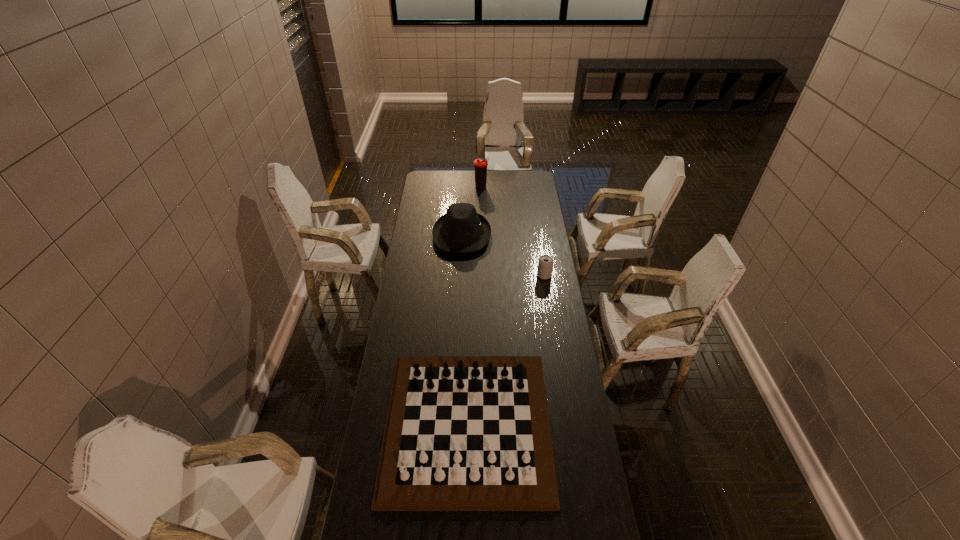
Find the location of a particular element. This screenshot has width=960, height=540. unoccupied position between the third shortest object and the gameboard is located at coordinates (465, 329).

At what (x,y) coordinates should I click in order to perform the action: click on free space between the farthest object and the gameboard. Please return your answer as a coordinate pair (x, y). The image size is (960, 540). Looking at the image, I should click on (474, 306).

The height and width of the screenshot is (540, 960). What are the coordinates of `vacant area between the fedora and the nearest object` in the screenshot? It's located at (465, 329).

I want to click on vacant area that lies between the nearest object and the rightmost object, so click(506, 350).

Image resolution: width=960 pixels, height=540 pixels. Identify the location of object identified as the third closest to the rightmost object. (480, 164).

Locate an element on the screen. Image resolution: width=960 pixels, height=540 pixels. object that is the nearest to the rightmost object is located at coordinates (462, 229).

Identify the location of vacant area in the image that satisfies the following two spatial constraints: 1. on the front-facing side of the second tallest object; 2. on the right side of the nearest object. The image size is (960, 540). (453, 424).

Locate an element on the screen. This screenshot has width=960, height=540. free space that satisfies the following two spatial constraints: 1. on the front-facing side of the can; 2. on the left side of the fedora is located at coordinates (460, 275).

The width and height of the screenshot is (960, 540). Find the location of `free point that satisfies the following two spatial constraints: 1. on the front-facing side of the can; 2. on the left side of the third shortest object`. free point that satisfies the following two spatial constraints: 1. on the front-facing side of the can; 2. on the left side of the third shortest object is located at coordinates (460, 275).